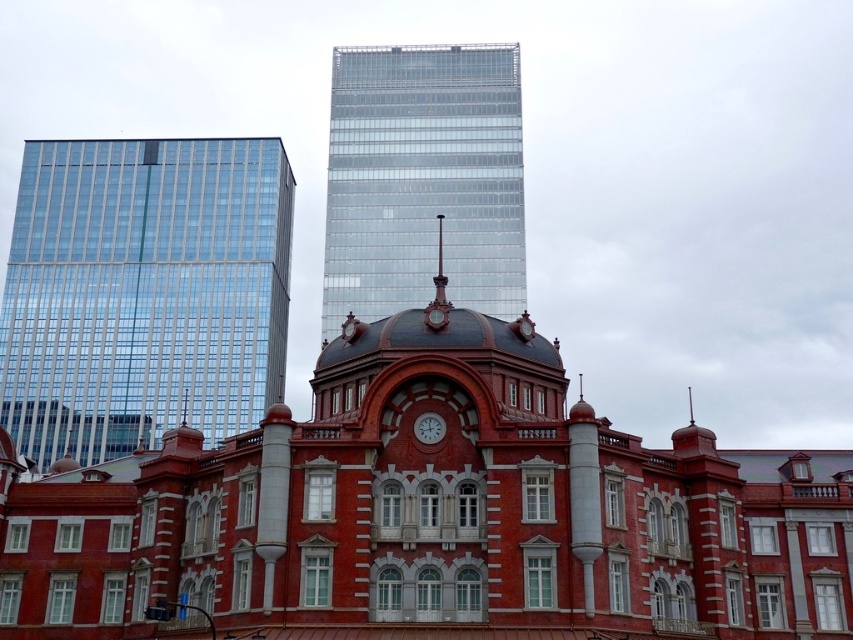
You are an architect planning to install a new decorative element between the transparent glass skyscraper at upper center and the matte red clock at center. Considering their widths, which object should the new element be placed closer to?

The transparent glass skyscraper at upper center is wider than the matte red clock at center, so the new decorative element should be placed closer to the matte red clock at center to maintain balance.

You are an architect analyzing the spatial relationship between the transparent glass skyscraper at upper center and the matte red clock at center. Which object appears closer to you in the image?

The transparent glass skyscraper at upper center appears closer to you than the matte red clock at center because it is positioned further to the viewer in the scene.

You are a city planner reviewing a proposal to install a new billboard between the two transparent glass skyscrapers. The billboard requires a minimum of 10 meters of space between the buildings to be placed safely. Can you determine if there is enough space between the transparent glass skyscraper at upper left and the transparent glass skyscraper at upper center based on their positions?

The transparent glass skyscraper at upper left is to the left of transparent glass skyscraper at upper center, but the distance between them is not specified in the description. Therefore, it is impossible to determine if there is enough space for the billboard based solely on their positions.